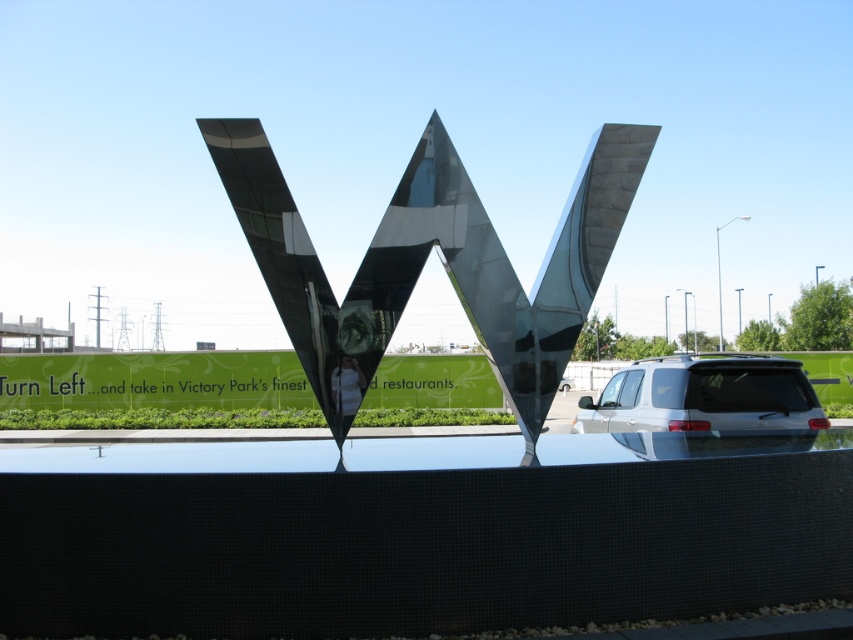
Question: Which of the following is the closest to the observer?

Choices:
 (A) (4, 381)
 (B) (24, 384)
 (C) (18, 394)
 (D) (0, 372)

Answer: (B)

Question: Does black metallic letter w at center lie behind metallic silver letter w at center?

Choices:
 (A) no
 (B) yes

Answer: (A)

Question: Which object is the closest to the metallic silver letter w at center?

Choices:
 (A) silver metallic suv at lower right
 (B) metallic reflective letter w at center
 (C) brown matte letter at center

Answer: (C)

Question: Can you confirm if metallic reflective letter w at center is positioned below brown matte letter at center?

Choices:
 (A) no
 (B) yes

Answer: (A)

Question: Is green matte sign at center to the right of metallic silver letter w at center from the viewer's perspective?

Choices:
 (A) no
 (B) yes

Answer: (B)

Question: Which point is farther to the camera?

Choices:
 (A) (431, 173)
 (B) (4, 380)
 (C) (137, 381)

Answer: (B)